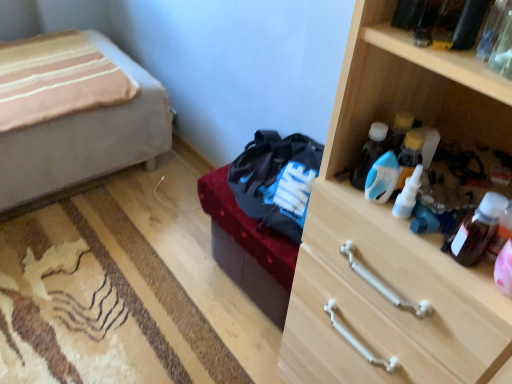
How much space does blue glossy bottle at upper right, positioned as the 5th bottle in right-to-left order, occupy horizontally?

The width of blue glossy bottle at upper right, positioned as the 5th bottle in right-to-left order, is 2.23 inches.

At what (x,y) coordinates should I click in order to perform the action: click on dark brown leather bed frame at center. Please return your answer as a coordinate pair (x, y). Image resolution: width=512 pixels, height=384 pixels. Looking at the image, I should click on (248, 248).

The width and height of the screenshot is (512, 384). In order to click on beige fabric bed at left in this screenshot , I will do `click(74, 114)`.

The image size is (512, 384). Describe the element at coordinates (74, 114) in the screenshot. I see `beige fabric bed at left` at that location.

Looking at this image, how much space does blue plastic bottle at center right, the second bottle in the left-to-right sequence, occupy horizontally?

blue plastic bottle at center right, the second bottle in the left-to-right sequence, is 1.26 inches in width.

Describe the element at coordinates (382, 178) in the screenshot. Image resolution: width=512 pixels, height=384 pixels. I see `blue plastic bottle at center right, the second bottle in the left-to-right sequence` at that location.

I want to click on blue glossy bottle at upper right, acting as the first bottle starting from the left, so pos(369,154).

What's the angular difference between blue glossy bottle at upper right, acting as the first bottle starting from the left, and dark brown leather bed frame at center's facing directions?

The angular difference between blue glossy bottle at upper right, acting as the first bottle starting from the left, and dark brown leather bed frame at center is 0.587 degrees.

Could you measure the distance between blue glossy bottle at upper right, acting as the first bottle starting from the left, and dark brown leather bed frame at center?

blue glossy bottle at upper right, acting as the first bottle starting from the left, and dark brown leather bed frame at center are 22.77 inches apart from each other.

Considering the relative positions of blue glossy bottle at upper right, acting as the first bottle starting from the left, and dark brown leather bed frame at center in the image provided, is blue glossy bottle at upper right, acting as the first bottle starting from the left, to the right of dark brown leather bed frame at center from the viewer's perspective?

Yes, blue glossy bottle at upper right, acting as the first bottle starting from the left, is to the right of dark brown leather bed frame at center.

Which of these two, blue glossy bottle at upper right, positioned as the 5th bottle in right-to-left order, or dark brown leather bed frame at center, is thinner?

blue glossy bottle at upper right, positioned as the 5th bottle in right-to-left order, is thinner.

Is blue plastic bottle at center right, the second bottle in the left-to-right sequence, closer to the viewer compared to translucent plastic bottle at upper right, the 5th bottle in the left-to-right sequence?

No, the depth of blue plastic bottle at center right, the second bottle in the left-to-right sequence, is greater than that of translucent plastic bottle at upper right, the 5th bottle in the left-to-right sequence.

Is point (371, 168) less distant than point (469, 265)?

No, it is behind (469, 265).

Can we say blue plastic bottle at center right, placed as the 4th bottle when sorted from right to left, lies outside translucent plastic bottle at upper right, the 5th bottle in the left-to-right sequence?

Yes, blue plastic bottle at center right, placed as the 4th bottle when sorted from right to left, is not within translucent plastic bottle at upper right, the 5th bottle in the left-to-right sequence.

From a real-world perspective, count 1st bottles upward from the blue plastic bottle at center right, placed as the 4th bottle when sorted from right to left, and point to it. Please provide its 2D coordinates.

[(478, 230)]

Which of these two, dark brown leather bed frame at center or white plastic bottle at upper right, which ranks as the fourth bottle in left-to-right order, is wider?

dark brown leather bed frame at center is wider.

Are dark brown leather bed frame at center and white plastic bottle at upper right, which ranks as the fourth bottle in left-to-right order, making contact?

There is a gap between dark brown leather bed frame at center and white plastic bottle at upper right, which ranks as the fourth bottle in left-to-right order.

Between dark brown leather bed frame at center and white plastic bottle at upper right, which ranks as the fourth bottle in left-to-right order, which one has larger size?

dark brown leather bed frame at center is bigger.

From the image's perspective, relative to white plastic bottle at upper right, positioned as the second bottle in right-to-left order, is translucent plastic bottle at upper right, the 1th bottle positioned from the right, above or below?

Based on their image positions, translucent plastic bottle at upper right, the 1th bottle positioned from the right, is located beneath white plastic bottle at upper right, positioned as the second bottle in right-to-left order.

Considering the sizes of objects translucent plastic bottle at upper right, the 5th bottle in the left-to-right sequence, and white plastic bottle at upper right, positioned as the second bottle in right-to-left order, in the image provided, who is smaller, translucent plastic bottle at upper right, the 5th bottle in the left-to-right sequence, or white plastic bottle at upper right, positioned as the second bottle in right-to-left order,?

white plastic bottle at upper right, positioned as the second bottle in right-to-left order, is smaller.

From a real-world perspective, who is located lower, translucent plastic bottle at upper right, the 1th bottle positioned from the right, or translucent plastic bottle at upper right, which is the 3th bottle in right-to-left order?

From a 3D spatial view, translucent plastic bottle at upper right, which is the 3th bottle in right-to-left order, is below.

Would you say translucent plastic bottle at upper right, the 1th bottle positioned from the right, is a long distance from translucent plastic bottle at upper right, which is the 3th bottle in left-to-right order?

No, there isn't a large distance between translucent plastic bottle at upper right, the 1th bottle positioned from the right, and translucent plastic bottle at upper right, which is the 3th bottle in left-to-right order.

Is translucent plastic bottle at upper right, the 1th bottle positioned from the right, to the left of translucent plastic bottle at upper right, which is the 3th bottle in right-to-left order, from the viewer's perspective?

Incorrect, translucent plastic bottle at upper right, the 1th bottle positioned from the right, is not on the left side of translucent plastic bottle at upper right, which is the 3th bottle in right-to-left order.

Is translucent plastic bottle at upper right, the 5th bottle in the left-to-right sequence, oriented away from translucent plastic bottle at upper right, which is the 3th bottle in left-to-right order?

That's not correct — translucent plastic bottle at upper right, the 5th bottle in the left-to-right sequence, is not looking away from translucent plastic bottle at upper right, which is the 3th bottle in left-to-right order.

Is translucent plastic bottle at upper right, the 1th bottle positioned from the right, oriented away from beige fabric bed at left?

translucent plastic bottle at upper right, the 1th bottle positioned from the right, is not turned away from beige fabric bed at left.

Would you say translucent plastic bottle at upper right, the 5th bottle in the left-to-right sequence, contains beige fabric bed at left?

No, beige fabric bed at left is not inside translucent plastic bottle at upper right, the 5th bottle in the left-to-right sequence.

Considering the positions of objects translucent plastic bottle at upper right, the 1th bottle positioned from the right, and beige fabric bed at left in the image provided, who is in front, translucent plastic bottle at upper right, the 1th bottle positioned from the right, or beige fabric bed at left?

translucent plastic bottle at upper right, the 1th bottle positioned from the right.

Considering the relative sizes of translucent plastic bottle at upper right, the 1th bottle positioned from the right, and beige fabric bed at left in the image provided, is translucent plastic bottle at upper right, the 1th bottle positioned from the right, taller than beige fabric bed at left?

In fact, translucent plastic bottle at upper right, the 1th bottle positioned from the right, may be shorter than beige fabric bed at left.

Can you see blue plastic bottle at center right, placed as the 4th bottle when sorted from right to left, touching white plastic bottle at upper right, positioned as the second bottle in right-to-left order?

Yes.

From a real-world perspective, is blue plastic bottle at center right, the second bottle in the left-to-right sequence, positioned over white plastic bottle at upper right, positioned as the second bottle in right-to-left order, based on gravity?

Yes.

Which point is more forward, (366, 195) or (406, 139)?

The point (406, 139) is closer to the camera.

Image resolution: width=512 pixels, height=384 pixels. Identify the location of bottle behind the blue plastic bottle at center right, the second bottle in the left-to-right sequence. (409, 156).

At what (x,y) coordinates should I click in order to perform the action: click on bed frame below the blue glossy bottle at upper right, positioned as the 5th bottle in right-to-left order (from a real-world perspective). Please return your answer as a coordinate pair (x, y). The width and height of the screenshot is (512, 384). Looking at the image, I should click on (248, 248).

At what (x,y) coordinates should I click in order to perform the action: click on the 3rd bottle to the left when counting from the translucent plastic bottle at upper right, the 5th bottle in the left-to-right sequence. Please return your answer as a coordinate pair (x, y). Looking at the image, I should click on (382, 178).

When comparing their distances from translucent plastic bottle at upper right, the 5th bottle in the left-to-right sequence, does dark brown leather bed frame at center or white plastic bottle at upper right, which ranks as the fourth bottle in left-to-right order, seem further?

dark brown leather bed frame at center is further to translucent plastic bottle at upper right, the 5th bottle in the left-to-right sequence.

Estimate the real-world distances between objects in this image. Which object is closer to white plastic bottle at upper right, which ranks as the fourth bottle in left-to-right order, blue glossy bottle at upper right, acting as the first bottle starting from the left, or translucent plastic bottle at upper right, the 5th bottle in the left-to-right sequence?

Based on the image, blue glossy bottle at upper right, acting as the first bottle starting from the left, appears to be nearer to white plastic bottle at upper right, which ranks as the fourth bottle in left-to-right order.

When comparing their distances from dark brown leather bed frame at center, does blue plastic bottle at center right, the second bottle in the left-to-right sequence, or beige fabric bed at left seem closer?

Based on the image, blue plastic bottle at center right, the second bottle in the left-to-right sequence, appears to be nearer to dark brown leather bed frame at center.

When comparing their distances from white plastic bottle at upper right, which ranks as the fourth bottle in left-to-right order, does dark brown leather bed frame at center or blue glossy bottle at upper right, acting as the first bottle starting from the left, seem closer?

blue glossy bottle at upper right, acting as the first bottle starting from the left, lies closer to white plastic bottle at upper right, which ranks as the fourth bottle in left-to-right order, than the other object.

Looking at the image, which one is located further to beige fabric bed at left, dark brown leather bed frame at center or blue plastic bottle at center right, the second bottle in the left-to-right sequence?

blue plastic bottle at center right, the second bottle in the left-to-right sequence, lies further to beige fabric bed at left than the other object.

Estimate the real-world distances between objects in this image. Which object is closer to beige fabric bed at left, translucent plastic bottle at upper right, the 1th bottle positioned from the right, or blue plastic bottle at center right, the second bottle in the left-to-right sequence?

Among the two, blue plastic bottle at center right, the second bottle in the left-to-right sequence, is located nearer to beige fabric bed at left.

From the picture: Based on their spatial positions, is beige fabric bed at left or blue glossy bottle at upper right, positioned as the 5th bottle in right-to-left order, further from dark brown leather bed frame at center?

beige fabric bed at left is positioned further to the anchor dark brown leather bed frame at center.

Estimate the real-world distances between objects in this image. Which object is further from white plastic bottle at upper right, positioned as the second bottle in right-to-left order, beige fabric bed at left or blue glossy bottle at upper right, acting as the first bottle starting from the left?

The object further to white plastic bottle at upper right, positioned as the second bottle in right-to-left order, is beige fabric bed at left.

Find the location of `bottle between beige fabric bed at left and blue plastic bottle at center right, placed as the 4th bottle when sorted from right to left, from left to right`. bottle between beige fabric bed at left and blue plastic bottle at center right, placed as the 4th bottle when sorted from right to left, from left to right is located at coordinates (369, 154).

The height and width of the screenshot is (384, 512). In order to click on bed frame between beige fabric bed at left and blue glossy bottle at upper right, positioned as the 5th bottle in right-to-left order in this screenshot , I will do `click(248, 248)`.

Image resolution: width=512 pixels, height=384 pixels. I want to click on bed frame located between beige fabric bed at left and blue plastic bottle at center right, placed as the 4th bottle when sorted from right to left, in the left-right direction, so click(248, 248).

Find the location of a particular element. This screenshot has width=512, height=384. bed frame between beige fabric bed at left and translucent plastic bottle at upper right, which is the 3th bottle in left-to-right order, in the horizontal direction is located at coordinates (248, 248).